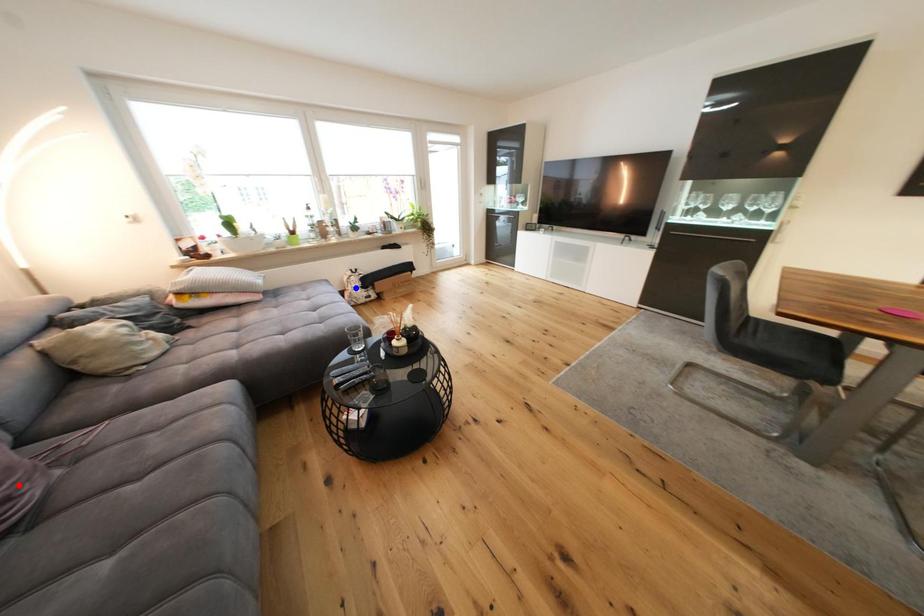
Question: In the image, two points are highlighted. Which point is nearer to the camera? Reply with the corresponding letter.

Choices:
 (A) blue point
 (B) red point

Answer: (B)